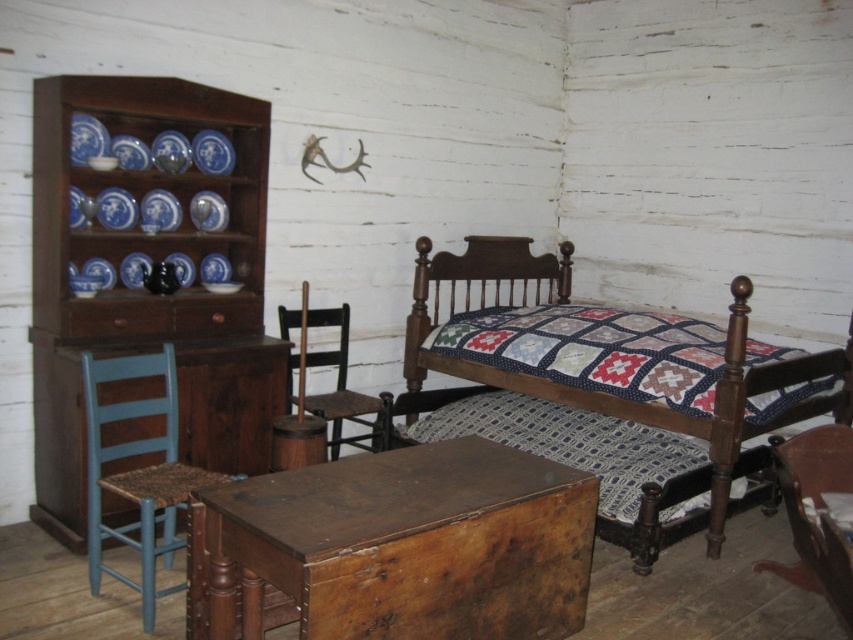
Between quilted fabric at center and brown wood drawer at left, which one appears on the left side from the viewer's perspective?

From the viewer's perspective, brown wood drawer at left appears more on the left side.

Which is below, quilted fabric at center or brown wood drawer at left?

Positioned lower is quilted fabric at center.

The width and height of the screenshot is (853, 640). Find the location of `quilted fabric at center`. quilted fabric at center is located at coordinates (572, 442).

The height and width of the screenshot is (640, 853). What are the coordinates of `quilted fabric at center` in the screenshot? It's located at (572, 442).

Which is more to the left, dark brown wood dresser at left or dark brown wooden chair at center?

dark brown wood dresser at left is more to the left.

Does dark brown wood dresser at left have a lesser height compared to dark brown wooden chair at center?

No, dark brown wood dresser at left is not shorter than dark brown wooden chair at center.

What do you see at coordinates (148, 292) in the screenshot? The height and width of the screenshot is (640, 853). I see `dark brown wood dresser at left` at bounding box center [148, 292].

The image size is (853, 640). I want to click on dark brown wood dresser at left, so pos(148,292).

Is wooden quilted bed at center thinner than wooden chair at center?

In fact, wooden quilted bed at center might be wider than wooden chair at center.

Is point (606, 387) positioned behind point (776, 566)?

Yes, point (606, 387) is farther from viewer.

You are a GUI agent. You are given a task and a screenshot of the screen. Output one action in this format:
    pyautogui.click(x=<x>, y=<y>)
    Task: Click on the wooden quilted bed at center
    
    Given the screenshot: What is the action you would take?
    pyautogui.click(x=614, y=387)